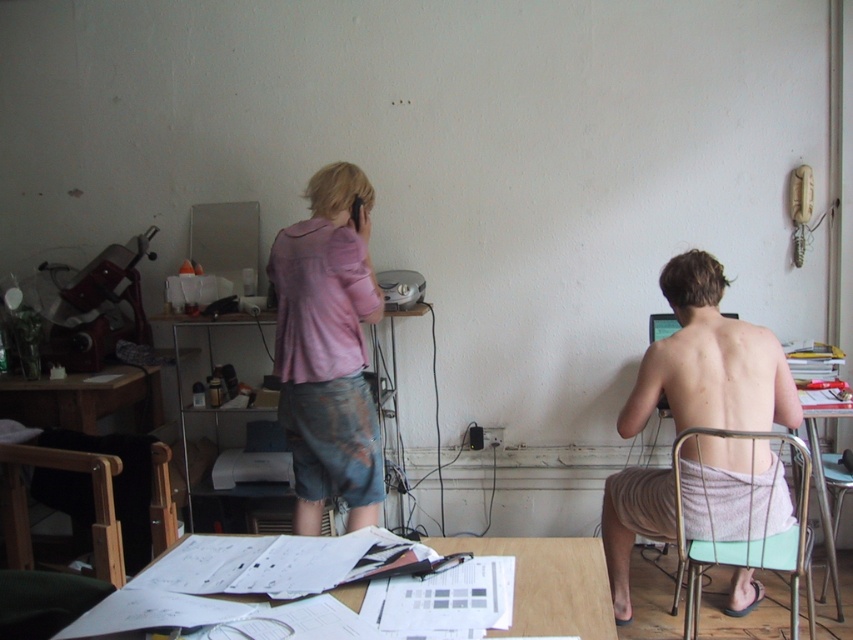
Question: Which of the following is the farthest from the observer?

Choices:
 (A) (314, 435)
 (B) (740, 387)

Answer: (A)

Question: Which point is closer to the camera?

Choices:
 (A) matte plastic printer at center
 (B) green plastic chair at lower right
 (C) white paper at center

Answer: (C)

Question: Can you confirm if pink cotton shirt at center is positioned to the right of matte plastic printer at center?

Choices:
 (A) yes
 (B) no

Answer: (A)

Question: Considering the real-world distances, which object is farthest from the matte plastic printer at center?

Choices:
 (A) pink cotton shirt at center
 (B) green plastic chair at lower right
 (C) gray towel at right

Answer: (B)

Question: Considering the relative positions of gray towel at right and white paper at center in the image provided, where is gray towel at right located with respect to white paper at center?

Choices:
 (A) right
 (B) left

Answer: (A)

Question: In this image, where is white paper at center located relative to matte plastic printer at center?

Choices:
 (A) right
 (B) left

Answer: (A)